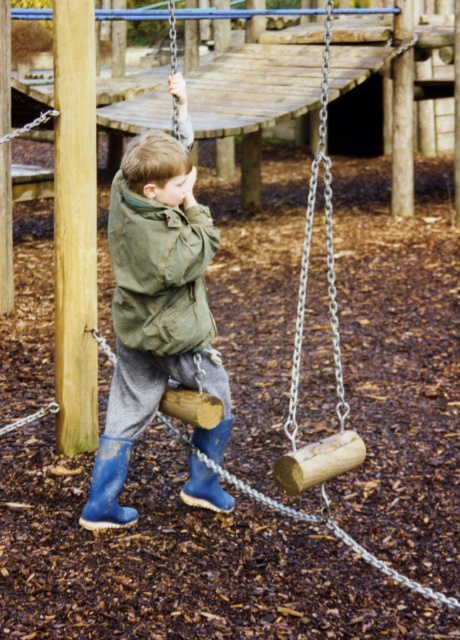
Between matte green jacket at center and green canvas jacket at center, which one is positioned lower?

matte green jacket at center

Does matte green jacket at center have a lesser width compared to green canvas jacket at center?

No, matte green jacket at center is not thinner than green canvas jacket at center.

Which is behind, point (113, 180) or point (149, 244)?

Positioned behind is point (113, 180).

Locate an element on the screen. The height and width of the screenshot is (640, 460). matte green jacket at center is located at coordinates (155, 305).